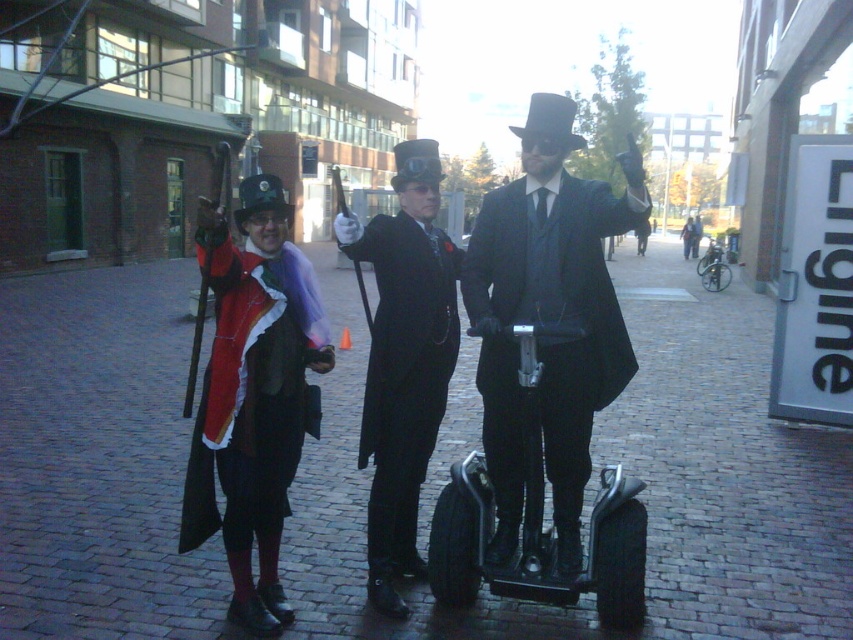
You are a photographer trying to capture a group photo of the matte black suit at center and the velvet red coat at left. Since you want to ensure both subjects are in focus, you need to know which one is bigger. Which one is larger?

The matte black suit at center is larger in size than the velvet red coat at left, so it is bigger.

You are a photographer trying to capture a group photo of the velvet red coat at left and the metallic silver scooter at center. Since you want both subjects to appear equally sized in the photo, which object should you move closer to the camera?

You should move the velvet red coat at left closer to the camera because it has a lesser width compared to the metallic silver scooter at center, so bringing it nearer will make them appear similar in size.

You are a photographer trying to capture a clear shot of both the matte black suit at center and the black glossy suit at center. Which one is closer to the camera based on their positions?

The matte black suit at center is in front of the black glossy suit at center, so it is closer to the camera.